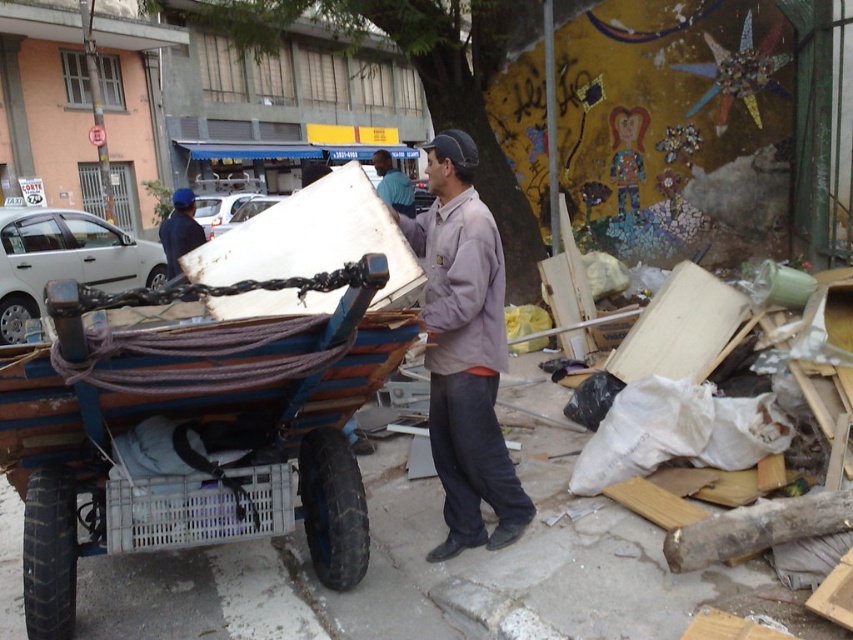
Question: Among these points, which one is farthest from the camera?

Choices:
 (A) (474, 234)
 (B) (161, 525)
 (C) (186, 211)

Answer: (C)

Question: Estimate the real-world distances between objects in this image. Which object is closer to the dark blue uniform at left?

Choices:
 (A) blue wooden wagon at lower left
 (B) blue shirt at center
 (C) white plastic crate at lower left

Answer: (B)

Question: Can you confirm if dark blue uniform at left is wider than blue shirt at center?

Choices:
 (A) no
 (B) yes

Answer: (B)

Question: Is gray cotton shirt at center positioned behind dark blue uniform at left?

Choices:
 (A) yes
 (B) no

Answer: (B)

Question: Which of the following is the farthest from the observer?

Choices:
 (A) gray cotton shirt at center
 (B) blue wooden wagon at lower left
 (C) white plastic crate at lower left

Answer: (A)

Question: Can you confirm if gray cotton shirt at center is thinner than blue shirt at center?

Choices:
 (A) no
 (B) yes

Answer: (B)